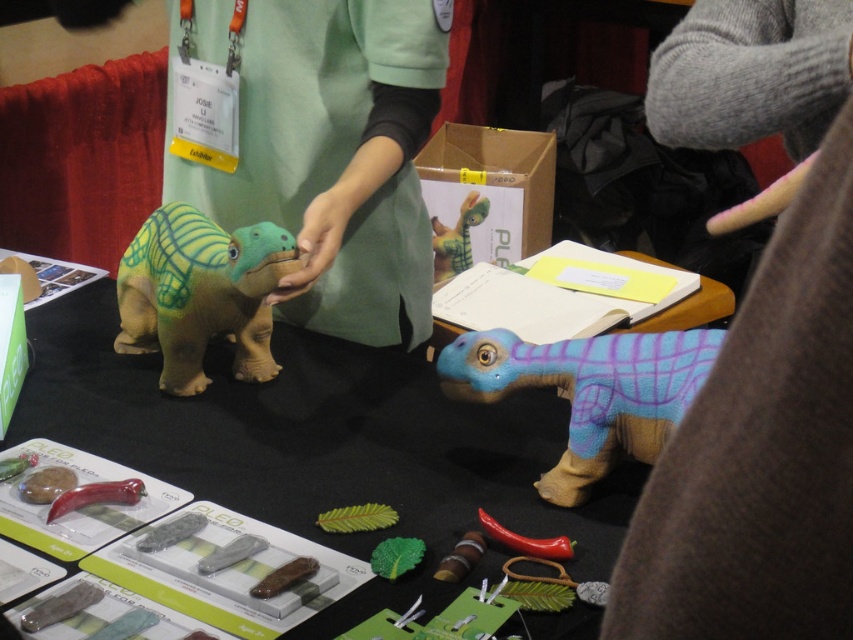
How much distance is there between gray wool sweater at upper right and textured green plush dinosaur at center?

The distance of gray wool sweater at upper right from textured green plush dinosaur at center is 25.02 inches.

Consider the image. Can you confirm if gray wool sweater at upper right is positioned below textured green plush dinosaur at center?

No.

I want to click on gray wool sweater at upper right, so click(x=758, y=348).

Which is below, gray wool sweater at upper right or brown matte table at center?

Positioned lower is brown matte table at center.

Can you confirm if gray wool sweater at upper right is positioned to the right of brown matte table at center?

Yes, gray wool sweater at upper right is to the right of brown matte table at center.

Where is `gray wool sweater at upper right`? Image resolution: width=853 pixels, height=640 pixels. gray wool sweater at upper right is located at coordinates (758, 348).

Find the location of a particular element. gray wool sweater at upper right is located at coordinates (758, 348).

Describe the element at coordinates (322, 445) in the screenshot. I see `brown matte table at center` at that location.

Between brown matte table at center and green fabric dinosaur at center, which one appears on the right side from the viewer's perspective?

From the viewer's perspective, green fabric dinosaur at center appears more on the right side.

Does point (276, 461) come closer to viewer compared to point (463, 244)?

Yes, it is.

Identify the location of brown matte table at center. (322, 445).